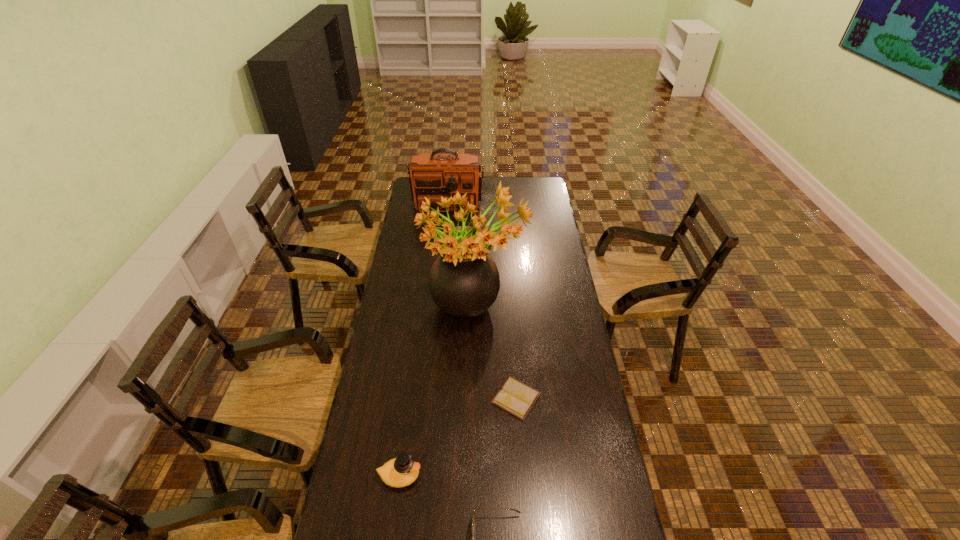
The image size is (960, 540). Identify the location of the tallest object. (464, 281).

The height and width of the screenshot is (540, 960). Identify the location of the fourth nearest object. (464, 281).

The height and width of the screenshot is (540, 960). In order to click on satchel in this screenshot , I will do `click(434, 175)`.

The image size is (960, 540). I want to click on the farthest object, so click(x=434, y=175).

Find the location of a particular element. The image size is (960, 540). the third tallest object is located at coordinates click(x=401, y=471).

Identify the location of duck. This screenshot has width=960, height=540. (401, 471).

Identify the location of diary. This screenshot has height=540, width=960. (515, 397).

You are a GUI agent. You are given a task and a screenshot of the screen. Output one action in this format:
    pyautogui.click(x=<x>, y=<y>)
    Task: Click on the third nearest object
    The height and width of the screenshot is (540, 960).
    Given the screenshot: What is the action you would take?
    pyautogui.click(x=515, y=397)

At what (x,y) coordinates should I click in order to perform the action: click on blank area located 0.280m on the back of the tallest object. Please return your answer as a coordinate pair (x, y). The width and height of the screenshot is (960, 540). Looking at the image, I should click on (475, 240).

I want to click on free space located 0.050m on the face side of the satchel, so click(x=445, y=222).